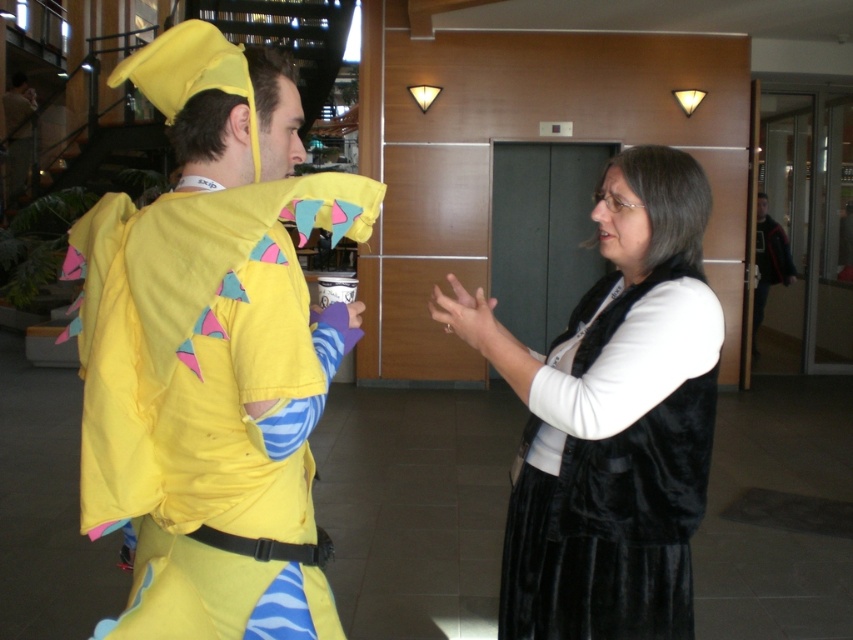
You are a photographer trying to capture a group photo of the matte yellow costume at left and the dark gray sweater at right. Since you want everyone to appear the same height in the photo, which person should stand on a small stool?

The matte yellow costume at left is not as tall as dark gray sweater at right, so the matte yellow costume at left should stand on a small stool to appear the same height in the photo.

You are standing in the lobby and want to take a photo of the matte yellow costume at left. If your camera has a minimum focus distance of 4 feet, will you be able to capture a clear image?

The distance between the matte yellow costume at left and the camera is 4.24 feet, which is slightly beyond the camera minimum focus distance of 4 feet. Therefore, the camera can still focus on the matte yellow costume at left and capture a clear image.